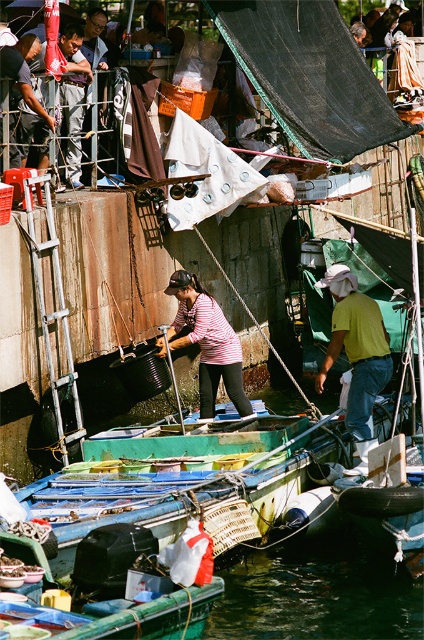
Question: Which point is closer to the camera?

Choices:
 (A) (172, 273)
 (B) (334, 339)
 (C) (72, 99)
 (D) (7, 64)

Answer: (B)

Question: Does striped fabric shirt at center lie in front of dark blue shirt at center?

Choices:
 (A) yes
 (B) no

Answer: (A)

Question: Which object is the closest to the yellow matte shirt at center?

Choices:
 (A) striped fabric shirt at center
 (B) dark blue shirt at center

Answer: (A)

Question: Is striped fabric shirt at center to the left of dark blue shirt at center from the viewer's perspective?

Choices:
 (A) no
 (B) yes

Answer: (A)

Question: Considering the real-world distances, which object is farthest from the matte black shirt at center?

Choices:
 (A) yellow matte shirt at center
 (B) dark green water at lower center
 (C) dark blue shirt at center

Answer: (B)

Question: Can you confirm if striped fabric shirt at center is positioned above dark blue shirt at center?

Choices:
 (A) no
 (B) yes

Answer: (A)